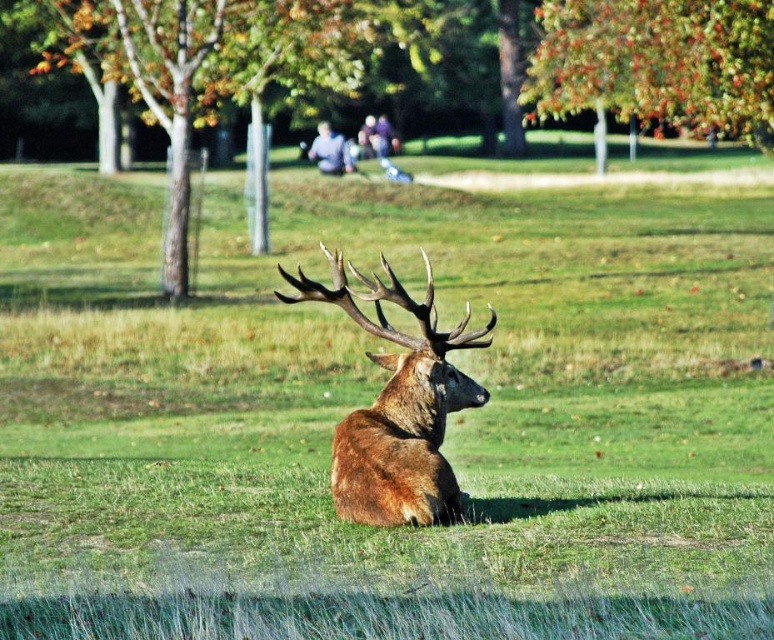
Looking at this image, you are a photographer trying to capture the brown velvet deer at center without the green leafy tree at upper center blocking the view. Can you move closer to the deer to ensure the tree doesn not appear in the photo?

The green leafy tree at upper center is further to the viewer than the brown velvet deer at center, so moving closer to the deer would bring the tree closer in the frame, making it more likely to block the view. Therefore, you should move away from the deer to keep the tree out of the photo.

You are standing in the park and want to take a photo of the green leafy tree at upper center. Where should you position yourself to capture it in the center of your camera viewfinder?

To capture the green leafy tree at upper center in the center of your camera viewfinder, position yourself directly in front of it at point (658,61).